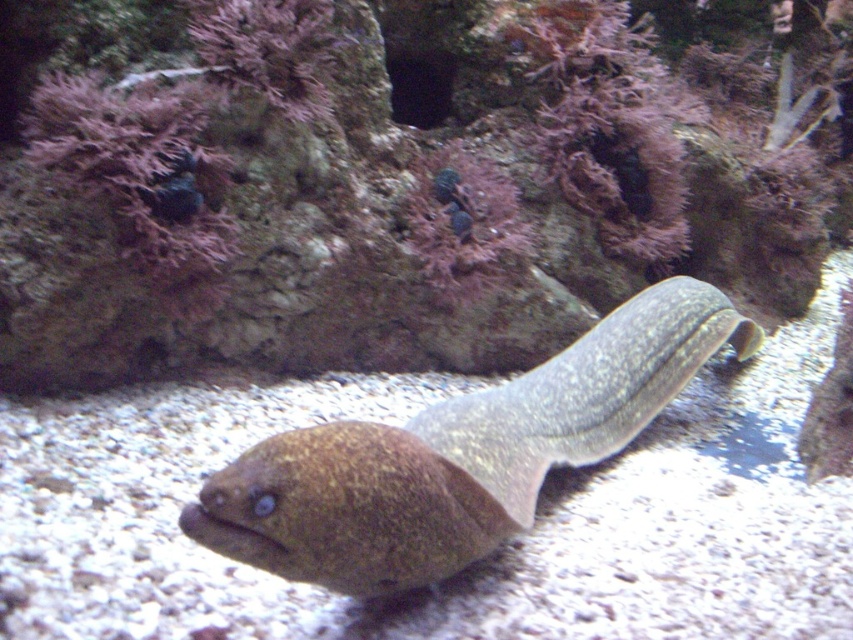
Does purple coral at center appear under purple coral at upper center?

Incorrect, purple coral at center is not positioned below purple coral at upper center.

Who is lower down, purple coral at center or purple coral at upper center?

purple coral at upper center is below.

Locate an element on the screen. purple coral at center is located at coordinates (608, 124).

Which of these two, brown speckled eel at center or purple coral at center, stands taller?

purple coral at center is taller.

Which is more to the left, brown speckled eel at center or purple coral at center?

Positioned to the left is brown speckled eel at center.

Which is in front, point (608, 422) or point (645, 42)?

Point (608, 422) is more forward.

At what (x,y) coordinates should I click in order to perform the action: click on brown speckled eel at center. Please return your answer as a coordinate pair (x, y). The width and height of the screenshot is (853, 640). Looking at the image, I should click on (457, 456).

Who is positioned more to the left, brown speckled eel at center or purple coral at upper center?

purple coral at upper center is more to the left.

Does point (622, 403) lie behind point (467, 198)?

No, (622, 403) is in front of (467, 198).

Find the location of a particular element. Image resolution: width=853 pixels, height=640 pixels. brown speckled eel at center is located at coordinates (457, 456).